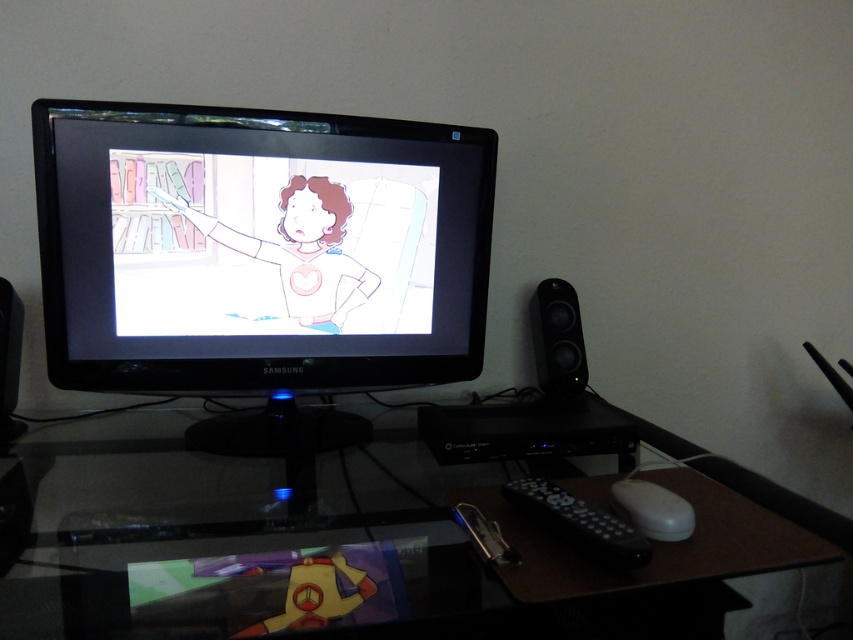
Question: Among these points, which one is nearest to the camera?

Choices:
 (A) (535, 499)
 (B) (538, 381)

Answer: (A)

Question: Can you confirm if transparent glass computer desk at center is bigger than black plastic speaker at right?

Choices:
 (A) yes
 (B) no

Answer: (A)

Question: Which object is positioned farthest from the black plastic speaker at right?

Choices:
 (A) black plastic speaker at left
 (B) white plastic mouse at lower right

Answer: (A)

Question: Is satin black monitor at center to the right of transparent glass computer desk at center from the viewer's perspective?

Choices:
 (A) no
 (B) yes

Answer: (A)

Question: Which of the following is the farthest from the observer?

Choices:
 (A) (163, 312)
 (B) (566, 321)
 (C) (672, 512)
 (D) (598, 547)

Answer: (B)

Question: Can you confirm if transparent glass computer desk at center is bigger than white plastic mouse at lower right?

Choices:
 (A) no
 (B) yes

Answer: (B)